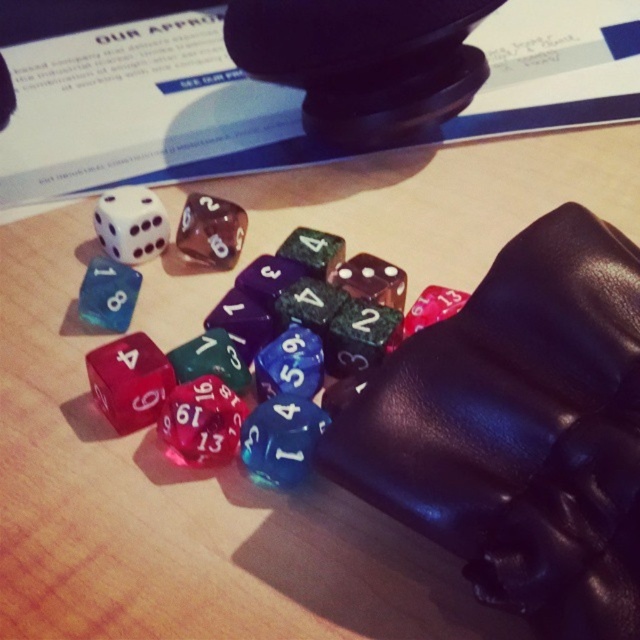
Question: Is translucent plastic dice at center further to the viewer compared to translucent blue die at center-left?

Choices:
 (A) no
 (B) yes

Answer: (A)

Question: Among these objects, which one is nearest to the camera?

Choices:
 (A) white matte die at center-left
 (B) translucent plastic dice at center
 (C) translucent blue die at center-left

Answer: (B)

Question: Can you confirm if translucent plastic dice at center is positioned above translucent blue die at center-left?

Choices:
 (A) yes
 (B) no

Answer: (B)

Question: Among these points, which one is farthest from the camera?

Choices:
 (A) (392, 321)
 (B) (113, 292)

Answer: (B)

Question: Does translucent plastic dice at center have a greater width compared to translucent blue die at center-left?

Choices:
 (A) no
 (B) yes

Answer: (B)

Question: Among these objects, which one is nearest to the camera?

Choices:
 (A) translucent blue die at center-left
 (B) translucent plastic dice at center

Answer: (B)